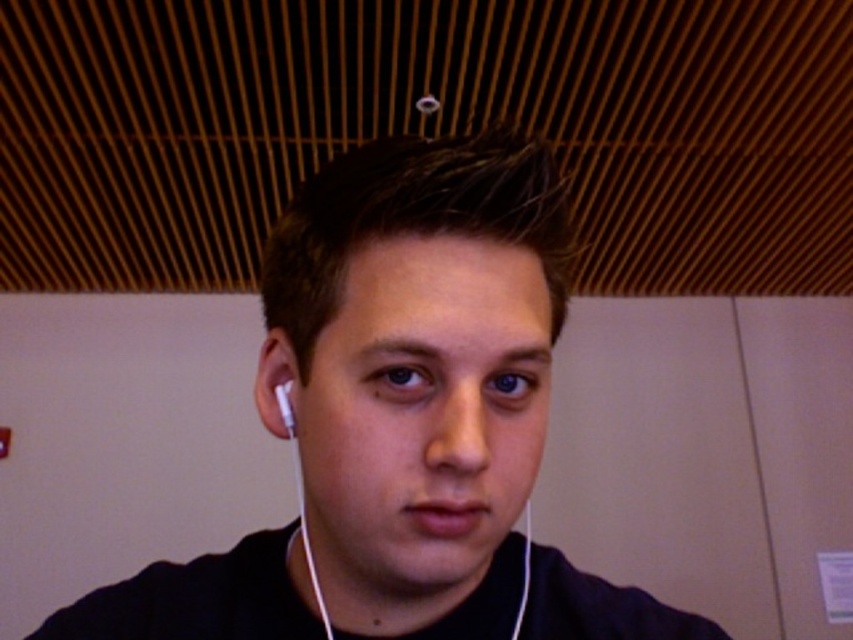
Who is lower down, black matte earphones at center or white earbud at left?

Positioned lower is black matte earphones at center.

Between point (119, 614) and point (286, 352), which one is positioned behind?

The point (119, 614) is behind.

The height and width of the screenshot is (640, 853). What do you see at coordinates (421, 372) in the screenshot?
I see `black matte earphones at center` at bounding box center [421, 372].

The height and width of the screenshot is (640, 853). What are the coordinates of `black matte earphones at center` in the screenshot? It's located at (421, 372).

Is point (486, 429) behind point (277, 403)?

No, (486, 429) is in front of (277, 403).

Is black matte earphones at center wider than white matte earphone at left?

Yes, black matte earphones at center is wider than white matte earphone at left.

Which is in front, point (550, 218) or point (285, 392)?

Positioned in front is point (550, 218).

Image resolution: width=853 pixels, height=640 pixels. Identify the location of black matte earphones at center. (421, 372).

Is white earbud at left thinner than white matte earphone at left?

Incorrect, white earbud at left's width is not less than white matte earphone at left's.

Does white earbud at left have a lesser height compared to white matte earphone at left?

No.

Locate an element on the screen. The height and width of the screenshot is (640, 853). white earbud at left is located at coordinates (276, 385).

The width and height of the screenshot is (853, 640). In order to click on white earbud at left in this screenshot , I will do `click(276, 385)`.